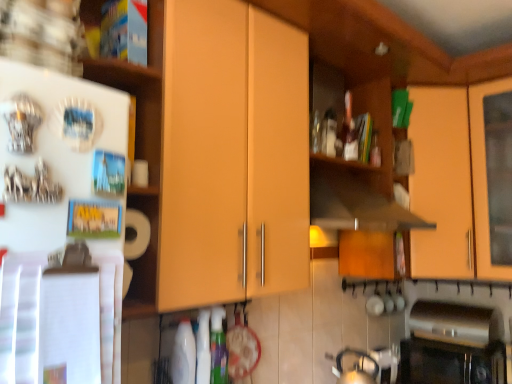
Question: Is point (208, 8) closer or farther from the camera than point (159, 0)?

Choices:
 (A) farther
 (B) closer

Answer: (A)

Question: Relative to wooden cabinet door at upper left, the 2th shelf positioned from the bottom, is matte wood cabinet at center, acting as the first cabinetry starting from the left, in front or behind?

Choices:
 (A) behind
 (B) front

Answer: (B)

Question: Based on their relative distances, which object is farther from the white paper towel at left, which ranks as the 1th shelf in bottom-to-top order?

Choices:
 (A) silver metallic tea pot at lower right
 (B) black glass oven at lower right
 (C) wooden cabinet door at upper left, the 2th shelf positioned from the bottom
 (D) matte wood cabinet at center, which is the first cabinetry from front to back
 (E) matte orange cabinet at upper right, the 1th cabinetry from the back

Answer: (B)

Question: Which object is the closest to the wooden cabinet door at upper left, which ranks as the first shelf in top-to-bottom order?

Choices:
 (A) matte wood cabinet at center, acting as the first cabinetry starting from the left
 (B) white paper towel at left, the 2th shelf positioned from the top
 (C) matte orange cabinet at upper right, the second cabinetry from the front
 (D) black glass oven at lower right
 (E) silver metallic tea pot at lower right

Answer: (B)